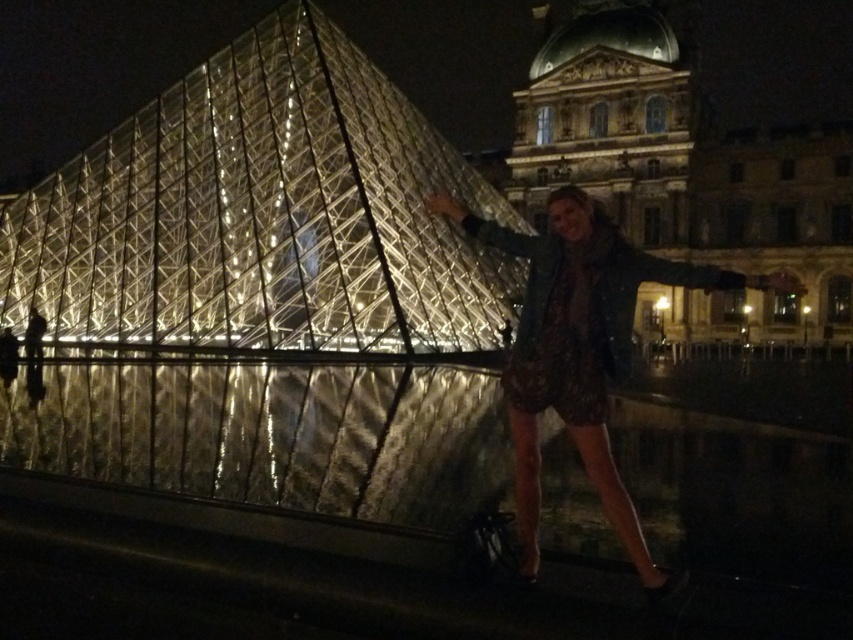
Can you confirm if transparent glass pyramid at center is positioned below dotted fabric dress at center?

No.

Does transparent glass pyramid at center appear on the left side of dotted fabric dress at center?

Yes, transparent glass pyramid at center is to the left of dotted fabric dress at center.

At what (x,y) coordinates should I click in order to perform the action: click on transparent glass pyramid at center. Please return your answer as a coordinate pair (x, y). The image size is (853, 640). Looking at the image, I should click on (263, 216).

At what (x,y) coordinates should I click in order to perform the action: click on transparent glass pyramid at center. Please return your answer as a coordinate pair (x, y). Looking at the image, I should click on (263, 216).

In the scene shown: Can you confirm if patterned fabric dress at center is smaller than dotted fabric dress at center?

No.

Is patterned fabric dress at center to the right of dotted fabric dress at center from the viewer's perspective?

Indeed, patterned fabric dress at center is positioned on the right side of dotted fabric dress at center.

Is point (569, 388) less distant than point (500, 234)?

Yes.

Identify the location of patterned fabric dress at center. (578, 349).

Is transparent glass pyramid at center smaller than patterned fabric dress at center?

No, transparent glass pyramid at center is not smaller than patterned fabric dress at center.

Which is in front, point (345, 202) or point (558, 305)?

Point (558, 305) is more forward.

Which is in front, point (294, 236) or point (573, 260)?

Point (573, 260) is in front.

Where is `transparent glass pyramid at center`? The height and width of the screenshot is (640, 853). transparent glass pyramid at center is located at coordinates click(x=263, y=216).